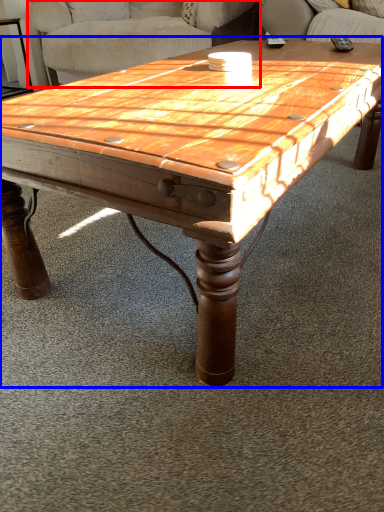
Question: Which object appears farthest to the camera in this image, swivel chair (highlighted by a red box) or coffee table (highlighted by a blue box)?

Choices:
 (A) swivel chair
 (B) coffee table

Answer: (A)